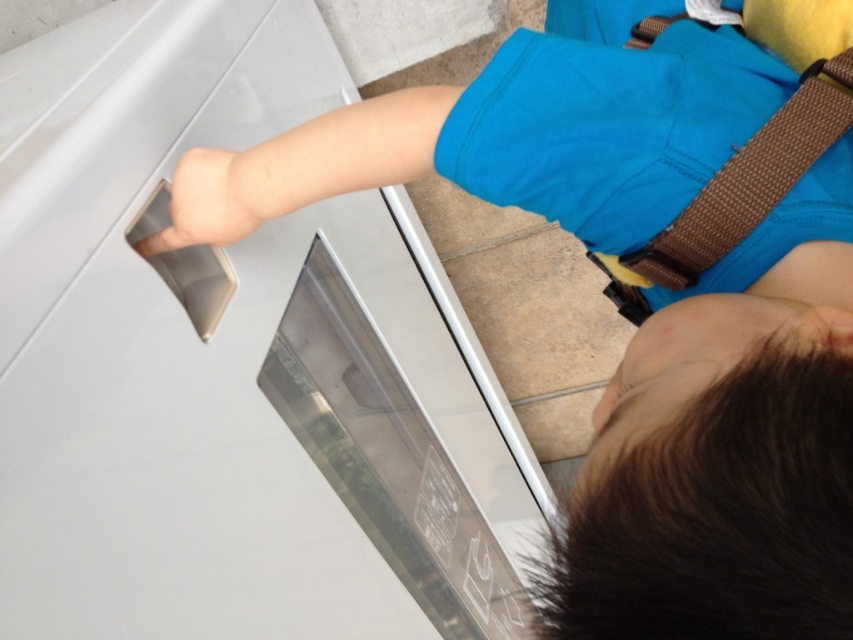
Does white glossy dishwasher at upper left appear under brown woven strap at upper right?

Yes.

Is white glossy dishwasher at upper left smaller than brown woven strap at upper right?

Incorrect, white glossy dishwasher at upper left is not smaller in size than brown woven strap at upper right.

Which is in front, point (401, 257) or point (711, 189)?

Point (711, 189) is more forward.

Find the location of a particular element. The height and width of the screenshot is (640, 853). white glossy dishwasher at upper left is located at coordinates (231, 364).

Who is positioned more to the right, brown woven strap at upper right or skinny beige handle at left?

From the viewer's perspective, brown woven strap at upper right appears more on the right side.

Is brown woven strap at upper right wider than skinny beige handle at left?

Yes, brown woven strap at upper right is wider than skinny beige handle at left.

Between point (724, 214) and point (167, 237), which one is positioned behind?

Point (167, 237)

Locate an element on the screen. The image size is (853, 640). brown woven strap at upper right is located at coordinates (751, 179).

Does white glossy dishwasher at upper left appear on the left side of skinny beige handle at left?

No, white glossy dishwasher at upper left is not to the left of skinny beige handle at left.

Identify the location of white glossy dishwasher at upper left. The width and height of the screenshot is (853, 640). (231, 364).